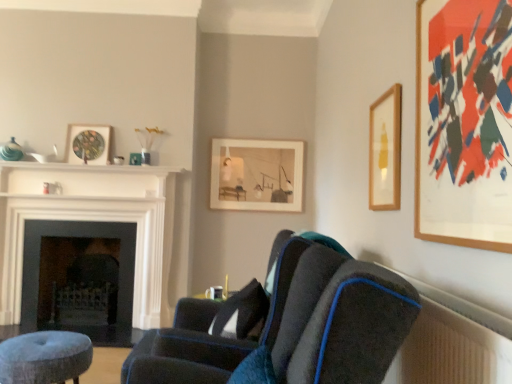
Question: Could matte glass picture frame at upper left, which ranks as the second picture frame in back-to-front order, be considered to be inside wooden framed artwork at upper right, the fourth picture frame from the back?

Choices:
 (A) no
 (B) yes

Answer: (A)

Question: From a real-world perspective, is wooden framed artwork at upper right, the fourth picture frame viewed from the left, on top of matte glass picture frame at upper left, which ranks as the 4th picture frame in right-to-left order?

Choices:
 (A) yes
 (B) no

Answer: (B)

Question: Considering the relative sizes of wooden framed artwork at upper right, which is counted as the first picture frame, starting from the front, and matte glass picture frame at upper left, which ranks as the second picture frame in back-to-front order, in the image provided, is wooden framed artwork at upper right, which is counted as the first picture frame, starting from the front, smaller than matte glass picture frame at upper left, which ranks as the second picture frame in back-to-front order,?

Choices:
 (A) no
 (B) yes

Answer: (A)

Question: Does wooden framed artwork at upper right, the fourth picture frame viewed from the left, appear on the right side of matte glass picture frame at upper left, which is counted as the 3th picture frame, starting from the front?

Choices:
 (A) yes
 (B) no

Answer: (A)

Question: Is wooden framed artwork at upper right, which appears as the first picture frame when viewed from the right, wider than matte glass picture frame at upper left, which ranks as the second picture frame in back-to-front order?

Choices:
 (A) no
 (B) yes

Answer: (A)

Question: In terms of width, does velvet blue stool at lower left look wider or thinner when compared to wooden framed artwork at upper right, the fourth picture frame from the back?

Choices:
 (A) wide
 (B) thin

Answer: (A)

Question: Is velvet blue stool at lower left inside the boundaries of wooden framed artwork at upper right, the fourth picture frame from the back, or outside?

Choices:
 (A) outside
 (B) inside

Answer: (A)

Question: From a real-world perspective, is velvet blue stool at lower left positioned above or below wooden framed artwork at upper right, which appears as the first picture frame when viewed from the right?

Choices:
 (A) below
 (B) above

Answer: (A)

Question: Looking at the image, does velvet blue stool at lower left seem bigger or smaller compared to wooden framed artwork at upper right, the fourth picture frame from the back?

Choices:
 (A) small
 (B) big

Answer: (B)

Question: Considering the positions of velvet blue stool at lower left and dark gray stone fireplace at left, the 1th fireplace viewed from the back, in the image, is velvet blue stool at lower left wider or thinner than dark gray stone fireplace at left, the 1th fireplace viewed from the back,?

Choices:
 (A) wide
 (B) thin

Answer: (A)

Question: Looking at the image, does velvet blue stool at lower left seem bigger or smaller compared to dark gray stone fireplace at left, which is the 2th fireplace in front-to-back order?

Choices:
 (A) big
 (B) small

Answer: (B)

Question: Visually, is velvet blue stool at lower left positioned to the left or to the right of dark gray stone fireplace at left, which is the 2th fireplace in front-to-back order?

Choices:
 (A) left
 (B) right

Answer: (B)

Question: From a real-world perspective, relative to dark gray stone fireplace at left, which is the 2th fireplace in front-to-back order, is velvet blue stool at lower left vertically above or below?

Choices:
 (A) below
 (B) above

Answer: (A)

Question: From the image's perspective, is velvet blue stool at lower left positioned above or below white glossy balustrade at upper center?

Choices:
 (A) below
 (B) above

Answer: (A)

Question: Is point (28, 334) positioned closer to the camera than point (7, 165)?

Choices:
 (A) closer
 (B) farther

Answer: (A)